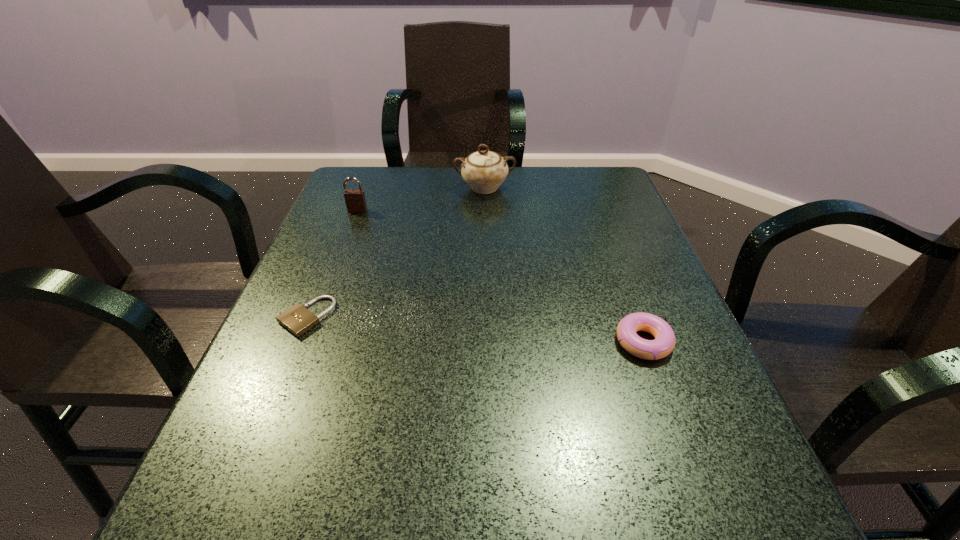
Locate an element on the screen. This screenshot has width=960, height=540. the tallest object is located at coordinates (484, 171).

You are a GUI agent. You are given a task and a screenshot of the screen. Output one action in this format:
    pyautogui.click(x=<x>, y=<y>)
    Task: Click on the second object from right to left
    
    Given the screenshot: What is the action you would take?
    pyautogui.click(x=484, y=171)

Locate an element on the screen. The height and width of the screenshot is (540, 960). the farther padlock is located at coordinates (355, 200).

In order to click on the third shortest object in this screenshot , I will do `click(355, 200)`.

Image resolution: width=960 pixels, height=540 pixels. I want to click on the rightmost object, so click(664, 343).

You are a GUI agent. You are given a task and a screenshot of the screen. Output one action in this format:
    pyautogui.click(x=<x>, y=<y>)
    Task: Click on the doughnut
    
    Given the screenshot: What is the action you would take?
    pyautogui.click(x=664, y=343)

The image size is (960, 540). I want to click on the nearer padlock, so click(298, 319).

Image resolution: width=960 pixels, height=540 pixels. I want to click on the shortest object, so click(x=298, y=319).

Where is `free space located 0.080m on the left of the second object from right to left`? free space located 0.080m on the left of the second object from right to left is located at coordinates (424, 188).

Identify the location of free space located on the front-facing side of the farther padlock. This screenshot has width=960, height=540. (348, 236).